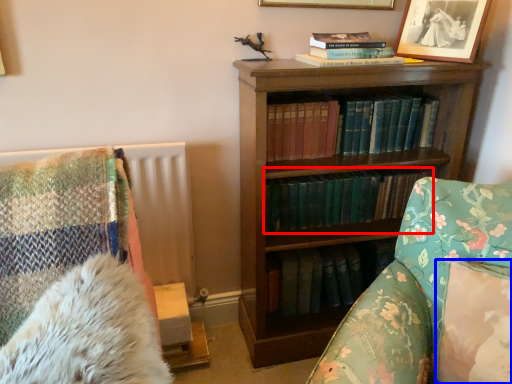
Question: Which object is further to the camera taking this photo, book (highlighted by a red box) or pillow (highlighted by a blue box)?

Choices:
 (A) book
 (B) pillow

Answer: (A)